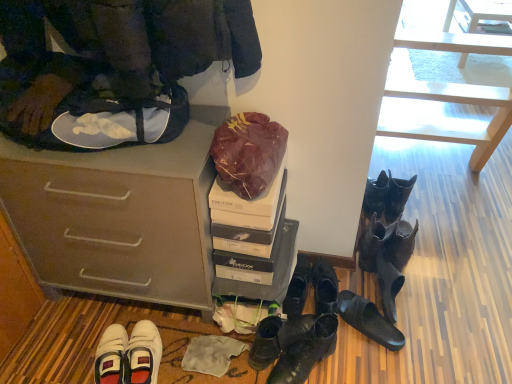
Question: Looking at their shapes, would you say burgundy fabric bag at upper center is wider or thinner than shiny black boots at center, the 7th footwear viewed from the right?

Choices:
 (A) wide
 (B) thin

Answer: (A)

Question: Is burgundy fabric bag at upper center taller or shorter than shiny black boots at center, placed as the 2th footwear when sorted from left to right?

Choices:
 (A) tall
 (B) short

Answer: (A)

Question: Considering the real-world distances, which object is farthest from the black leather shoes at lower center, the fourth footwear when ordered from left to right?

Choices:
 (A) leather boots at center, the 1th footwear positioned from the left
 (B) burgundy fabric bag at upper center
 (C) black rubber sandals at lower center, arranged as the 5th footwear when viewed from the left
 (D) white cardboard shoebox at center
 (E) black leather shoes at center, the sixth footwear viewed from the right

Answer: (B)

Question: Which object is positioned farthest from the black leather boots at lower right, arranged as the 3th footwear when viewed from the right?

Choices:
 (A) shiny black boots at center, the 7th footwear viewed from the right
 (B) white glossy table at upper right
 (C) white cardboard shoebox at center
 (D) burgundy fabric bag at upper center
 (E) black leather shoes at lower center, the fourth footwear when ordered from left to right

Answer: (B)